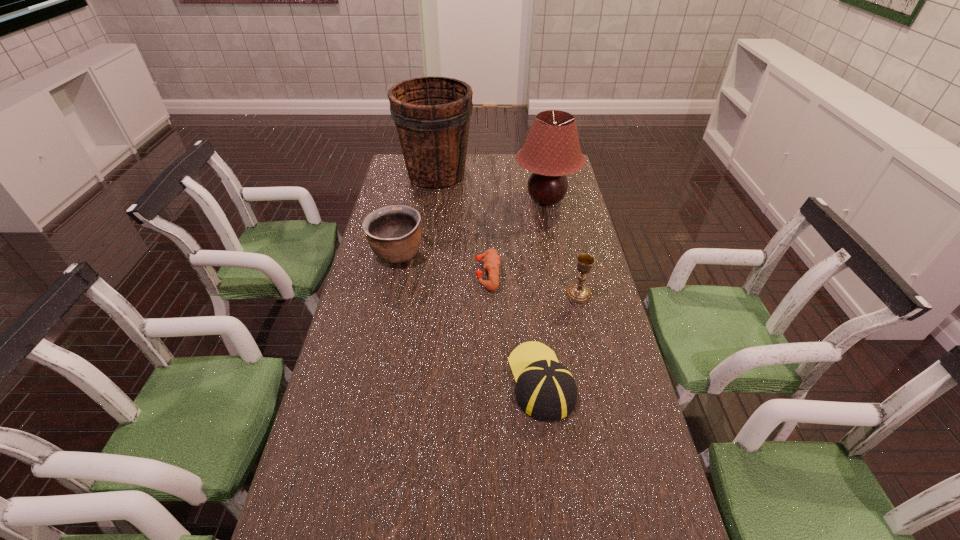
What are the coordinates of `free area in between the lampshade and the bucket` in the screenshot? It's located at (492, 187).

Image resolution: width=960 pixels, height=540 pixels. Find the location of `vacant space that's between the bucket and the fourth object from right to left`. vacant space that's between the bucket and the fourth object from right to left is located at coordinates (462, 224).

Where is `free space between the bucket and the puncher`? free space between the bucket and the puncher is located at coordinates (462, 224).

The width and height of the screenshot is (960, 540). In order to click on vacant area between the chalice and the lampshade in this screenshot , I will do `click(563, 247)`.

Locate an element on the screen. free space between the chalice and the bucket is located at coordinates (508, 234).

Identify the location of vacant space in between the lampshade and the chalice. Image resolution: width=960 pixels, height=540 pixels. (563, 247).

Where is `object that is the fifth nearest to the shortest object`? The width and height of the screenshot is (960, 540). object that is the fifth nearest to the shortest object is located at coordinates (432, 115).

Locate an element on the screen. This screenshot has height=540, width=960. the fourth closest object to the chalice is located at coordinates (393, 232).

Locate an element on the screen. free space that satisfies the following two spatial constraints: 1. on the back side of the pottery; 2. on the left side of the bucket is located at coordinates (414, 174).

Locate an element on the screen. The width and height of the screenshot is (960, 540). vacant space that satisfies the following two spatial constraints: 1. with the brim of the chalice facing forward; 2. on the right side of the fifth tallest object is located at coordinates (531, 294).